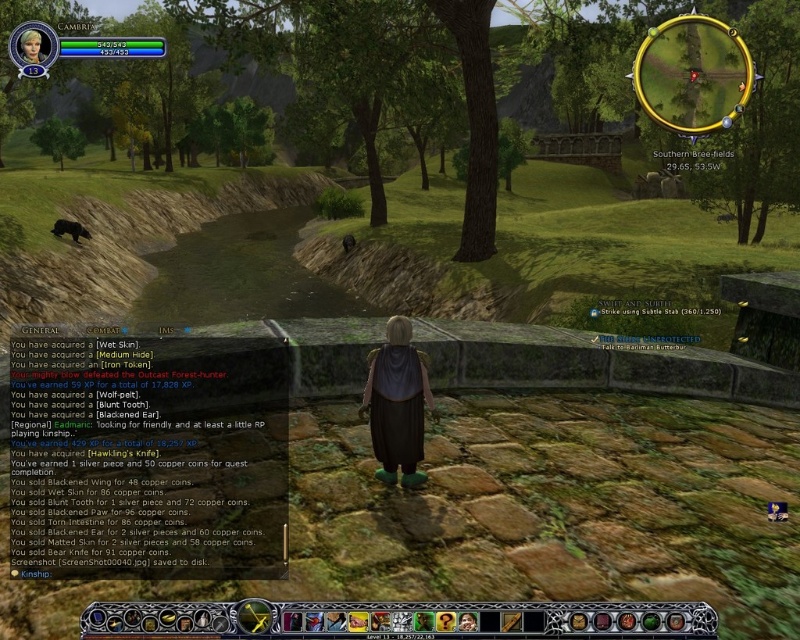
Question: Is matte black cloak at center behind blonde hair at upper left?

Choices:
 (A) no
 (B) yes

Answer: (B)

Question: Does matte black cloak at center appear on the left side of blonde hair at upper left?

Choices:
 (A) yes
 (B) no

Answer: (B)

Question: Is matte black cloak at center to the right of blonde hair at upper left from the viewer's perspective?

Choices:
 (A) yes
 (B) no

Answer: (A)